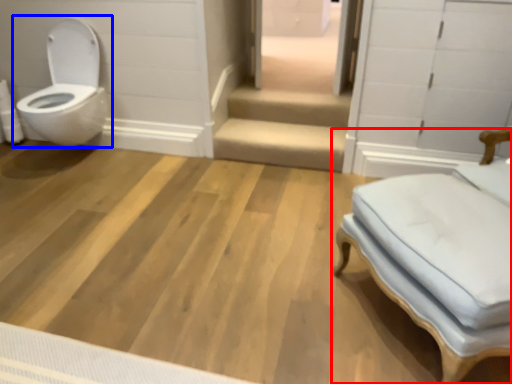
Question: Which object appears farthest to the camera in this image, furniture (highlighted by a red box) or toilet (highlighted by a blue box)?

Choices:
 (A) furniture
 (B) toilet

Answer: (B)